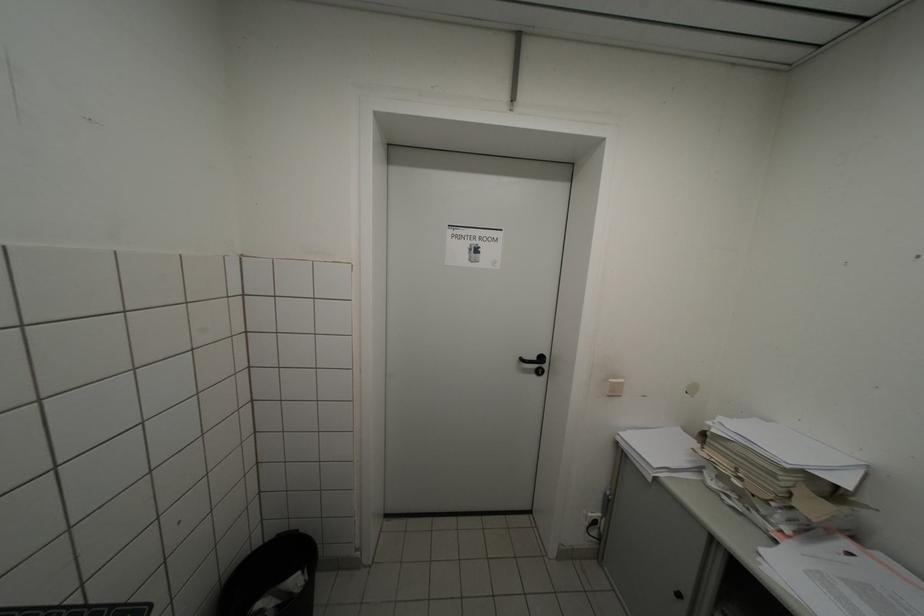
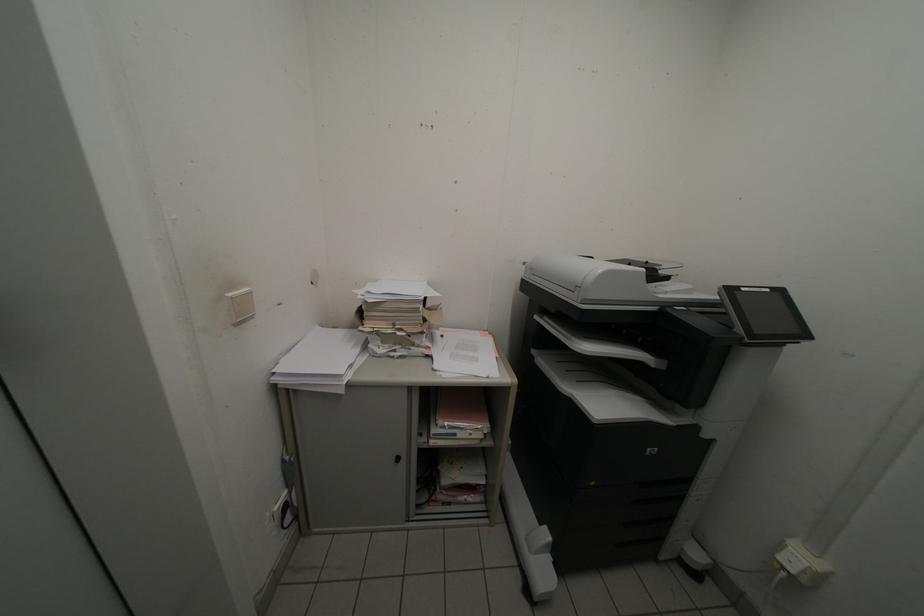
Consider the image. First-person continuous shooting, in which direction is the camera rotating?

The camera rotated toward right-down.